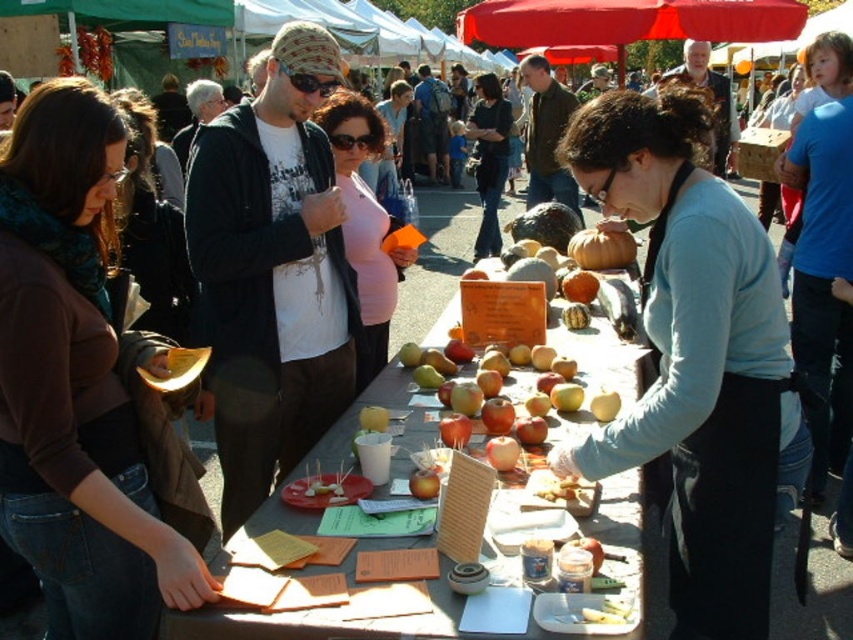
You are a customer at the market and want to place a small basket on the matte wooden table at center. The basket is 10 cm tall. Can the orange matte pumpkin at center fit underneath the basket without being blocked?

The matte wooden table at center has a greater height compared to the orange matte pumpkin at center. Since the pumpkin is shorter than the table, placing the basket on the table would leave enough space below it for the pumpkin to fit underneath without obstruction.

You are a photographer standing at the camera position. You want to take a photo of the light blue fabric apron at center without including the crowd to the left of the frame. Is the apron within your camera range?

The light blue fabric apron at center is 1.84 meters away from the camera, so it is within the camera range and can be captured without including the crowd to the left.

You are a customer at the market and want to pick up both the light blue fabric apron at center and the orange matte pumpkin at center. What is the minimum distance you need to walk to collect both items?

The minimum distance you need to walk to collect both items is 1.72 meters, as the light blue fabric apron at center and orange matte pumpkin at center are 1.72 meters apart from each other.